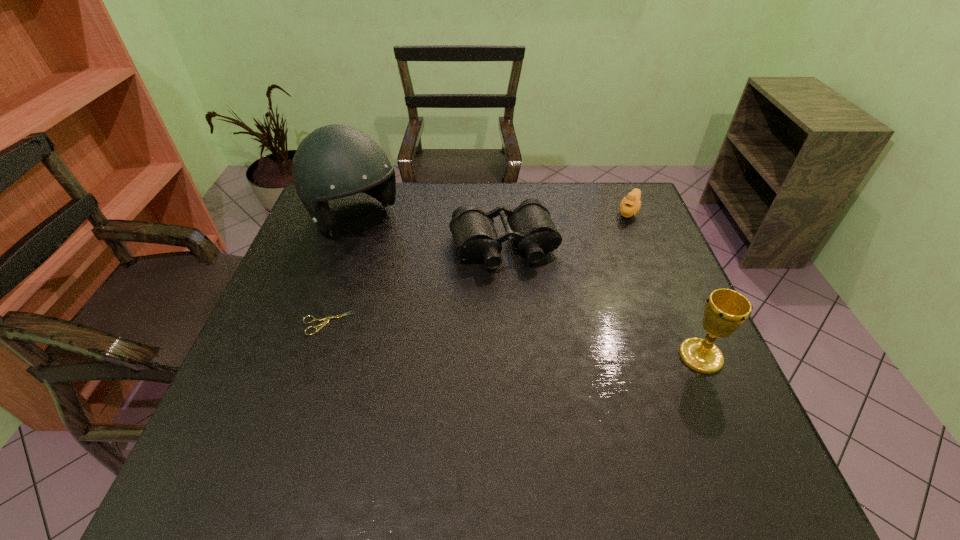
This screenshot has width=960, height=540. Identify the location of free space on the desktop that is between the shears and the fourth shortest object and is positioned through the eyepieces of the third object from left to right. [539, 342].

Where is `vacant spot on the desktop that is between the shears and the fourth shortest object and is positioned at the face opening of the football helmet`? The width and height of the screenshot is (960, 540). vacant spot on the desktop that is between the shears and the fourth shortest object and is positioned at the face opening of the football helmet is located at coordinates (486, 338).

You are a GUI agent. You are given a task and a screenshot of the screen. Output one action in this format:
    pyautogui.click(x=<x>, y=<y>)
    Task: Click on the vacant spot on the desktop that is between the shortest object and the second tallest object and is positioned on the face of the duckling
    
    Given the screenshot: What is the action you would take?
    pyautogui.click(x=558, y=344)